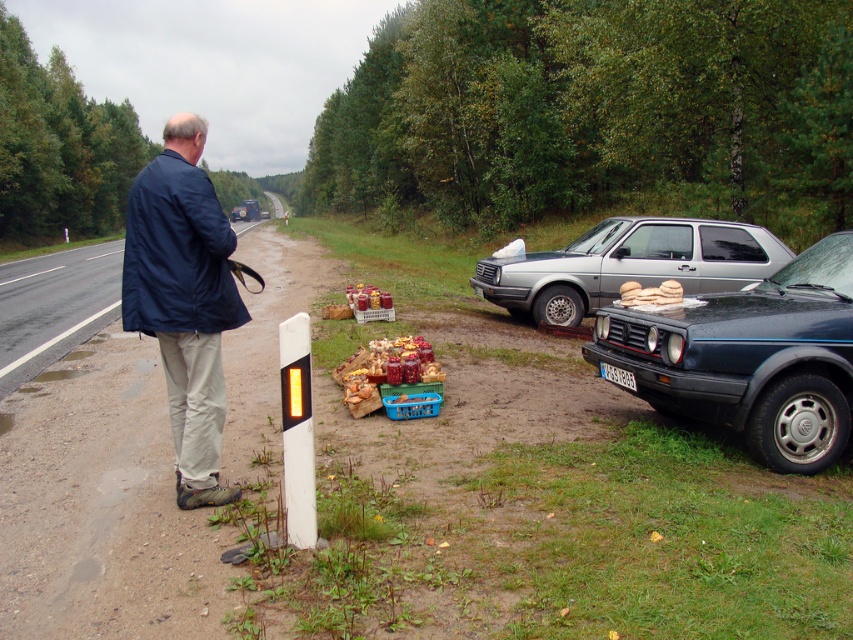
Which is above, dark blue fabric jacket at left or shiny plastic jars at center?

dark blue fabric jacket at left is above.

Which is more to the right, dark blue fabric jacket at left or shiny plastic jars at center?

Positioned to the right is shiny plastic jars at center.

Between point (209, 227) and point (375, 394), which one is positioned in front?

Point (209, 227) is more forward.

Locate an element on the screen. The height and width of the screenshot is (640, 853). dark blue fabric jacket at left is located at coordinates (183, 300).

Between point (403, 372) and point (665, 304), which one is positioned behind?

Point (403, 372)

Who is positioned more to the right, shiny plastic jars at center or white fluffy bread at center?

From the viewer's perspective, white fluffy bread at center appears more on the right side.

Does point (405, 365) come farther from viewer compared to point (630, 291)?

No, (405, 365) is closer to viewer.

Locate an element on the screen. shiny plastic jars at center is located at coordinates (387, 371).

Can you confirm if white fluffy bread at center is wider than black plastic license plate at lower center?

Yes, white fluffy bread at center is wider than black plastic license plate at lower center.

Who is more distant from viewer, (637, 300) or (631, 378)?

Positioned behind is point (637, 300).

Where is `white fluffy bread at center`? The height and width of the screenshot is (640, 853). white fluffy bread at center is located at coordinates (648, 292).